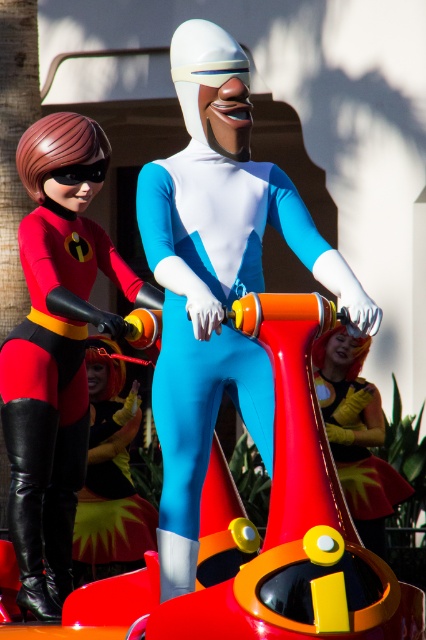
Question: Can you confirm if shiny gold helmet at center is thinner than shiny metallic helmet at center?

Choices:
 (A) no
 (B) yes

Answer: (B)

Question: Among these points, which one is farthest from the camera?

Choices:
 (A) (17, 600)
 (B) (89, 618)

Answer: (A)

Question: Is shiny gold helmet at center bigger than shiny metallic helmet at center?

Choices:
 (A) no
 (B) yes

Answer: (A)

Question: In this image, where is matte black bodysuit at left located relative to shiny metallic helmet at center?

Choices:
 (A) left
 (B) right

Answer: (B)

Question: Which object is positioned closest to the matte black bodysuit at left?

Choices:
 (A) white matte suit at center
 (B) shiny metallic helmet at center
 (C) shiny gold helmet at center

Answer: (A)

Question: Which point is closer to the camera taking this photo?

Choices:
 (A) (190, 403)
 (B) (356, 428)
 (C) (339, 490)
 (D) (135, 500)

Answer: (C)